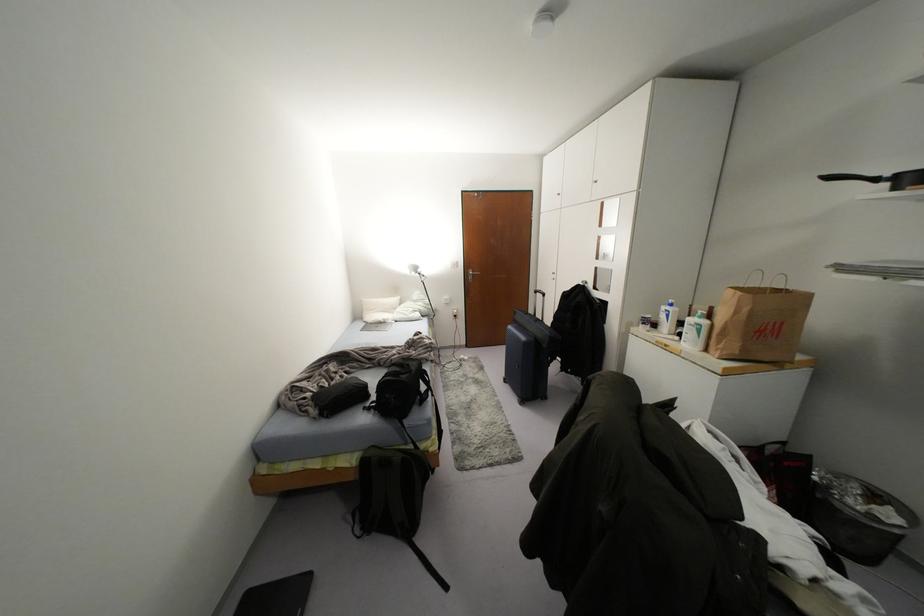
This screenshot has width=924, height=616. Identify the location of white lamp head. (417, 273).